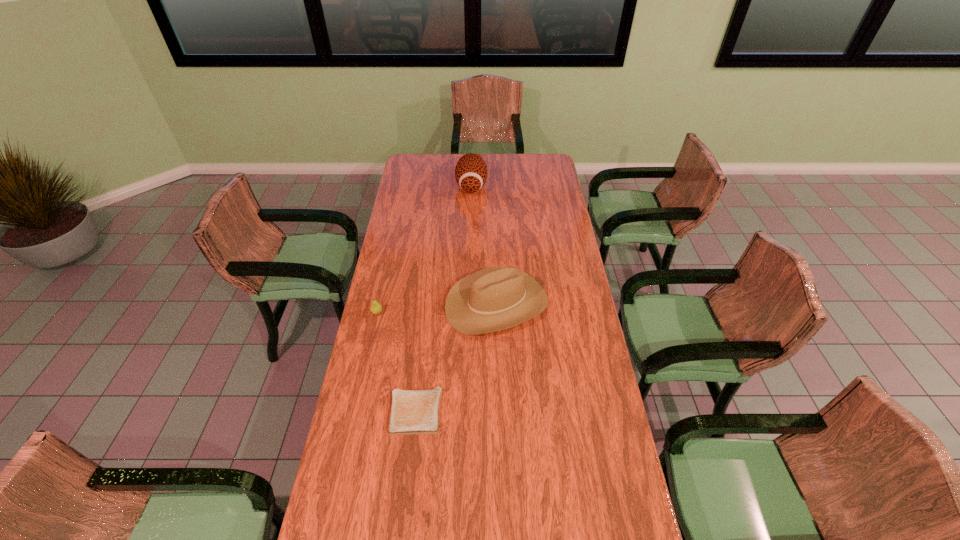
Locate an element on the screen. object present at the far edge is located at coordinates [471, 171].

Where is `pear positioned at the left edge`? The height and width of the screenshot is (540, 960). pear positioned at the left edge is located at coordinates (376, 308).

Locate an element on the screen. The width and height of the screenshot is (960, 540). toast that is at the left edge is located at coordinates (412, 411).

Locate an element on the screen. Image resolution: width=960 pixels, height=540 pixels. object that is positioned at the right edge is located at coordinates (496, 298).

In the image, there is a desktop. Where is `vacant region at the far edge`? The image size is (960, 540). vacant region at the far edge is located at coordinates (509, 157).

In the image, there is a desktop. Where is `vacant space at the left edge`? This screenshot has width=960, height=540. vacant space at the left edge is located at coordinates (403, 318).

Find the location of a particular element. The height and width of the screenshot is (540, 960). free location at the right edge of the desktop is located at coordinates point(580,269).

The width and height of the screenshot is (960, 540). Find the location of `vacant space at the far left corner of the desktop`. vacant space at the far left corner of the desktop is located at coordinates (425, 176).

The height and width of the screenshot is (540, 960). In the image, there is a desktop. What are the coordinates of `vacant space at the far right corner` in the screenshot? It's located at (550, 169).

At what (x,y) coordinates should I click in order to perform the action: click on free spot between the leftmost object and the cowboy hat. Please return your answer as a coordinate pair (x, y). Looking at the image, I should click on (437, 308).